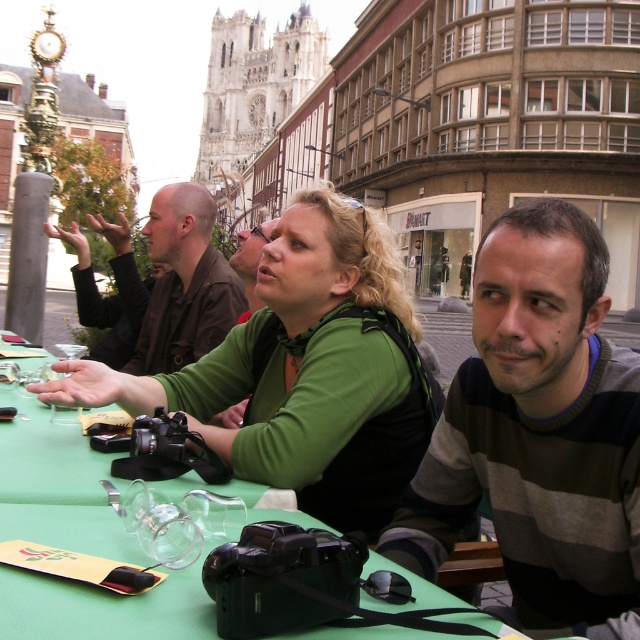
Who is higher up, green matte shirt at center or green fabric table at center?

green matte shirt at center

Is green matte shirt at center to the left of green fabric table at center from the viewer's perspective?

In fact, green matte shirt at center is to the right of green fabric table at center.

Does point (108, 394) lie behind point (83, 596)?

Yes.

This screenshot has width=640, height=640. Find the location of `green matte shirt at center`. green matte shirt at center is located at coordinates (307, 371).

Who is positioned more to the right, striped sweater at center or transparent glass wine glass at center?

striped sweater at center is more to the right.

Where is `striped sweater at center`? The image size is (640, 640). striped sweater at center is located at coordinates (538, 432).

I want to click on striped sweater at center, so click(x=538, y=432).

Where is `striped sweater at center`? striped sweater at center is located at coordinates (538, 432).

Which is more to the left, green matte shirt at center or brown leather jacket at upper left?

brown leather jacket at upper left

Does green matte shirt at center have a smaller size compared to brown leather jacket at upper left?

No.

Is point (346, 432) positioned behind point (189, 257)?

No, it is not.

Identify the location of green matte shirt at center. (307, 371).